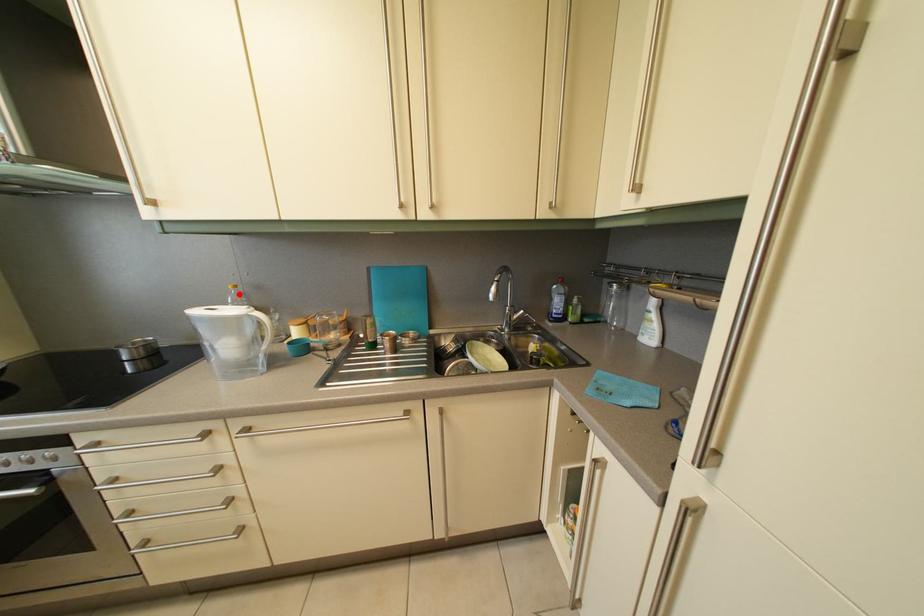
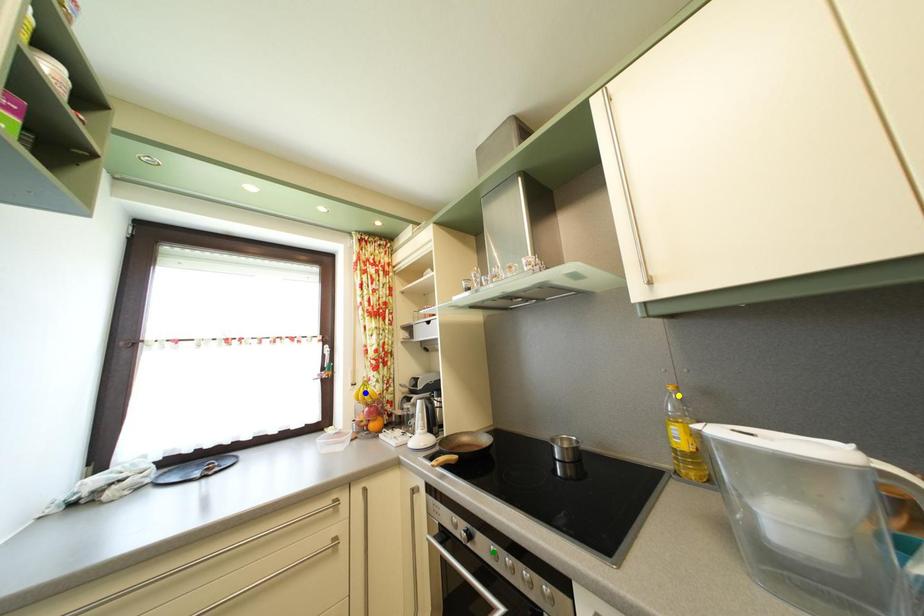
Question: I am providing you with two images of the same scene from different viewpoints. A red point is marked on the first image. You are given multiple points on the second image. Which mark in image 2 goes with the point in image 1?

Choices:
 (A) yellow point
 (B) green point
 (C) blue point

Answer: (A)